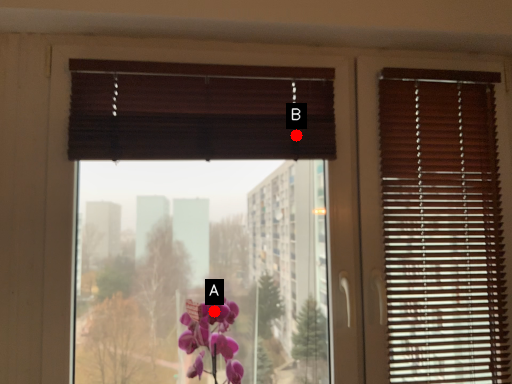
Question: Two points are circled on the image, labeled by A and B beside each circle. Which point is closer to the camera?

Choices:
 (A) A is closer
 (B) B is closer

Answer: (A)